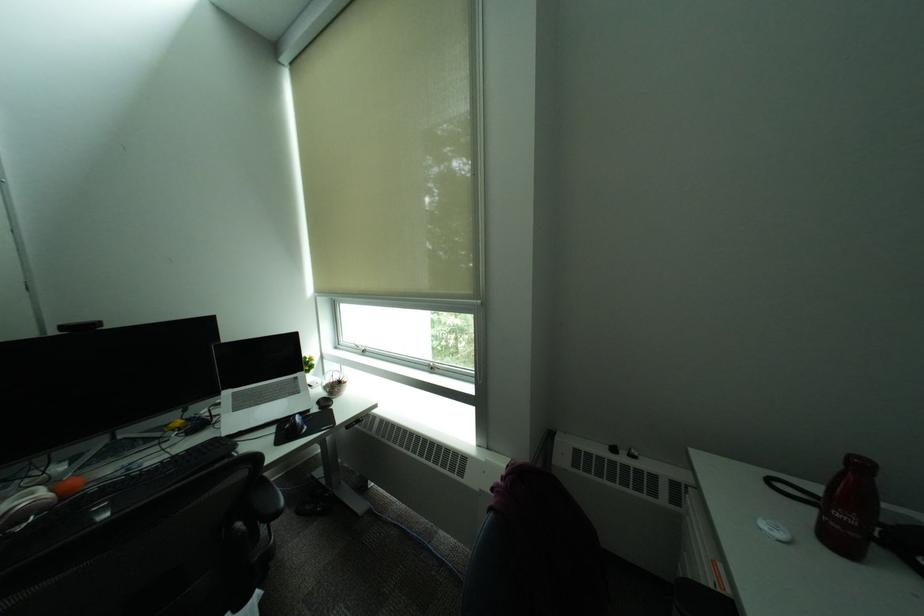
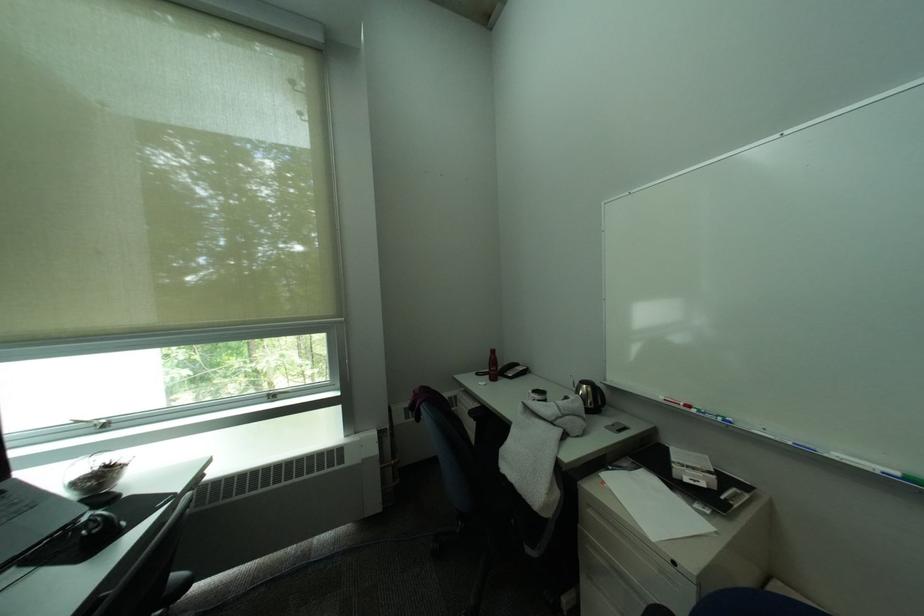
Find the pixel in the second image that matches the point at 443,365 in the first image.

(283, 392)